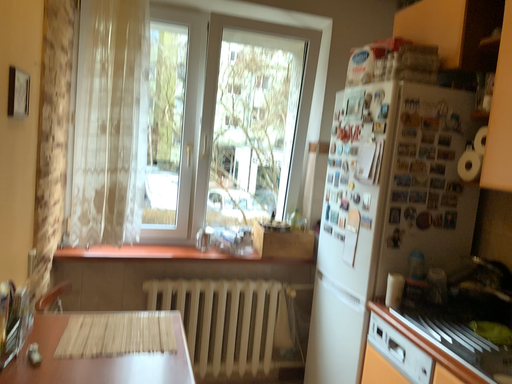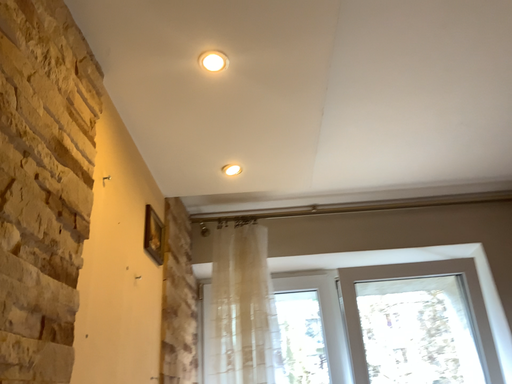
Question: Which way did the camera rotate in the video?

Choices:
 (A) rotated right
 (B) rotated left

Answer: (B)